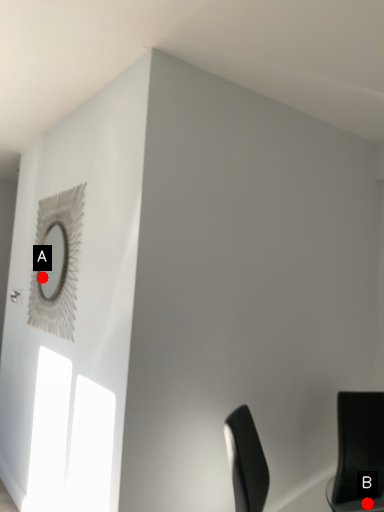
Question: Two points are circled on the image, labeled by A and B beside each circle. Which point is further to the camera?

Choices:
 (A) A is further
 (B) B is further

Answer: (A)